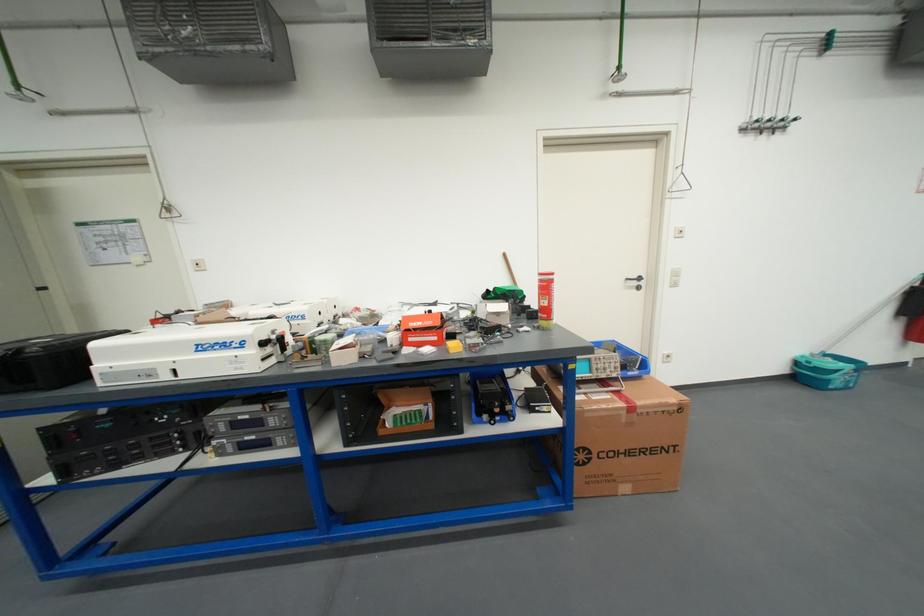
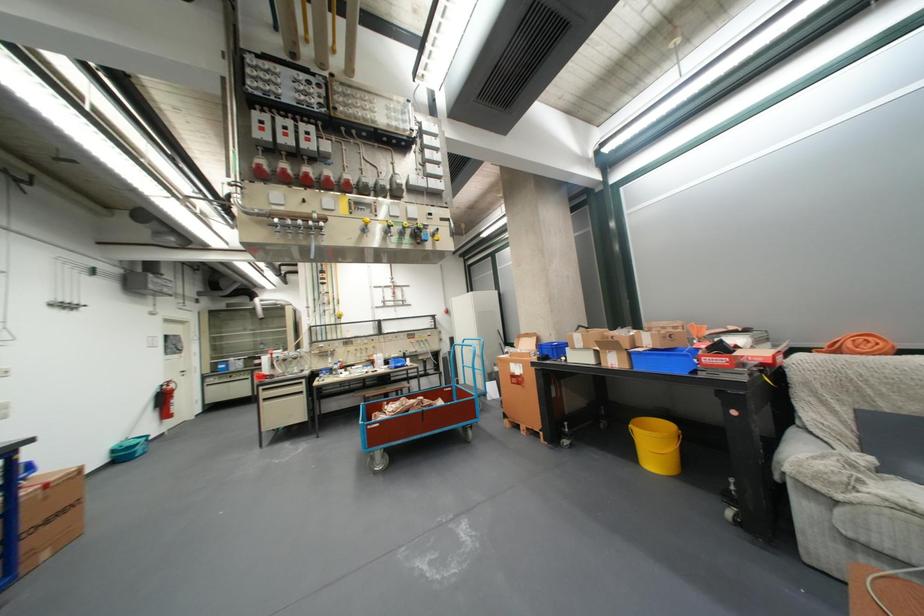
Find the pixel in the second image that matches (x=640, y=454) in the first image.

(59, 523)